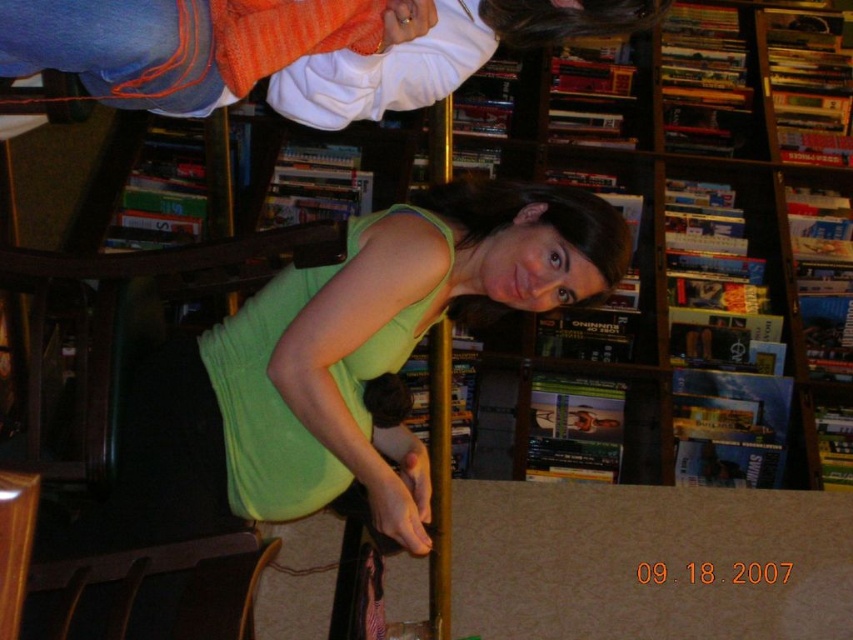
Question: Can you confirm if wooden bookshelf at center is wider than green matte tank top at center?

Choices:
 (A) no
 (B) yes

Answer: (B)

Question: Does wooden bookshelf at center appear on the right side of green matte tank top at center?

Choices:
 (A) yes
 (B) no

Answer: (A)

Question: Can you confirm if wooden bookshelf at center is positioned above green matte tank top at center?

Choices:
 (A) no
 (B) yes

Answer: (A)

Question: Which point appears farthest from the camera in this image?

Choices:
 (A) (223, 54)
 (B) (850, 412)

Answer: (B)